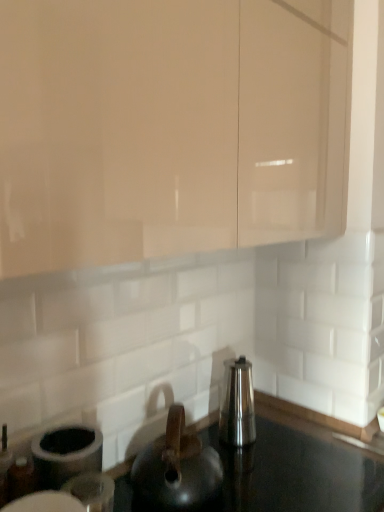
Question: Is matte black kettle at center not close to satin silver kettle at center?

Choices:
 (A) no
 (B) yes

Answer: (A)

Question: From the image's perspective, is matte black kettle at center beneath satin silver kettle at center?

Choices:
 (A) no
 (B) yes

Answer: (B)

Question: From a real-world perspective, is matte black kettle at center physically below satin silver kettle at center?

Choices:
 (A) yes
 (B) no

Answer: (A)

Question: Can you confirm if matte black kettle at center is wider than satin silver kettle at center?

Choices:
 (A) no
 (B) yes

Answer: (B)

Question: Considering the relative sizes of matte black kettle at center and satin silver kettle at center in the image provided, is matte black kettle at center smaller than satin silver kettle at center?

Choices:
 (A) no
 (B) yes

Answer: (A)

Question: Could you tell me if matte black kettle at center is facing satin silver kettle at center?

Choices:
 (A) no
 (B) yes

Answer: (A)

Question: Are matte beige cabinet at upper center and matte black kettle at center making contact?

Choices:
 (A) yes
 (B) no

Answer: (B)

Question: Is matte beige cabinet at upper center bigger than matte black kettle at center?

Choices:
 (A) no
 (B) yes

Answer: (B)

Question: From a real-world perspective, is matte beige cabinet at upper center below matte black kettle at center?

Choices:
 (A) no
 (B) yes

Answer: (A)

Question: Can you confirm if matte beige cabinet at upper center is thinner than matte black kettle at center?

Choices:
 (A) no
 (B) yes

Answer: (A)

Question: Can you confirm if matte beige cabinet at upper center is taller than matte black kettle at center?

Choices:
 (A) yes
 (B) no

Answer: (A)

Question: Considering the relative sizes of matte beige cabinet at upper center and matte black kettle at center in the image provided, is matte beige cabinet at upper center wider than matte black kettle at center?

Choices:
 (A) yes
 (B) no

Answer: (A)

Question: Is satin silver kettle at center thinner than black glossy countertop at center?

Choices:
 (A) yes
 (B) no

Answer: (A)